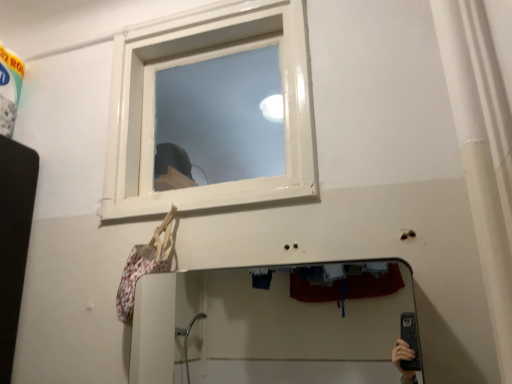
Question: Is point (302, 162) closer or farther from the camera than point (172, 278)?

Choices:
 (A) farther
 (B) closer

Answer: (B)

Question: From a real-world perspective, relative to smooth glass mirror at lower center, is white glossy window at upper center vertically above or below?

Choices:
 (A) below
 (B) above

Answer: (B)

Question: Do you think white glossy window at upper center is within smooth glass mirror at lower center, or outside of it?

Choices:
 (A) inside
 (B) outside

Answer: (B)

Question: From a real-world perspective, relative to white glossy window at upper center, is smooth glass mirror at lower center vertically above or below?

Choices:
 (A) below
 (B) above

Answer: (A)

Question: Relative to white glossy window at upper center, is smooth glass mirror at lower center in front or behind?

Choices:
 (A) front
 (B) behind

Answer: (A)

Question: Considering the relative positions of smooth glass mirror at lower center and white glossy window at upper center in the image provided, is smooth glass mirror at lower center to the left or to the right of white glossy window at upper center?

Choices:
 (A) left
 (B) right

Answer: (B)

Question: From the image's perspective, is smooth glass mirror at lower center positioned above or below white glossy window at upper center?

Choices:
 (A) below
 (B) above

Answer: (A)